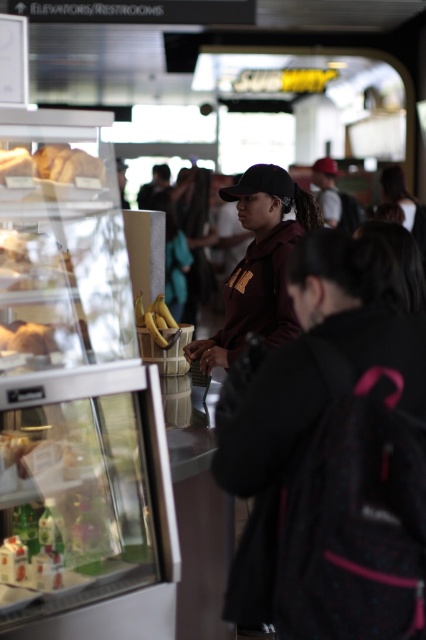
Question: Can you confirm if maroon fabric shirt at center is positioned to the left of yellow matte bananas at center?

Choices:
 (A) yes
 (B) no

Answer: (B)

Question: Is maroon hoodie at center in front of matte brown bread at upper left?

Choices:
 (A) yes
 (B) no

Answer: (A)

Question: Which of the following is the closest to the observer?

Choices:
 (A) matte brown bread at upper left
 (B) yellow matte bananas at center
 (C) maroon fabric shirt at center

Answer: (A)

Question: Which object appears closest to the camera in this image?

Choices:
 (A) matte brown bread at upper left
 (B) maroon fabric shirt at center

Answer: (A)

Question: Which object appears farthest from the camera in this image?

Choices:
 (A) black matte baseball cap at center
 (B) maroon hoodie at center

Answer: (A)

Question: Considering the relative positions of maroon fabric shirt at center and yellow matte bananas at center in the image provided, where is maroon fabric shirt at center located with respect to yellow matte bananas at center?

Choices:
 (A) below
 (B) above

Answer: (B)